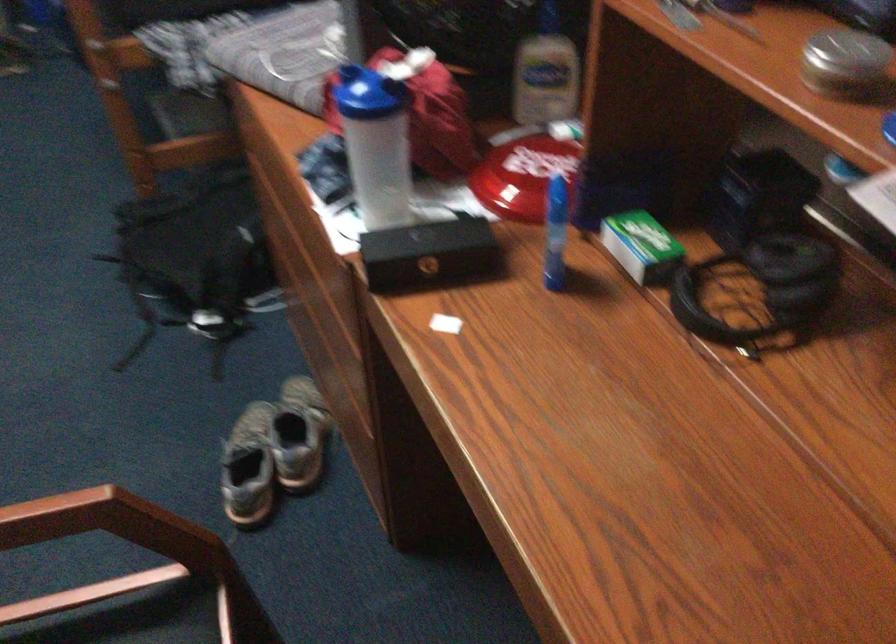
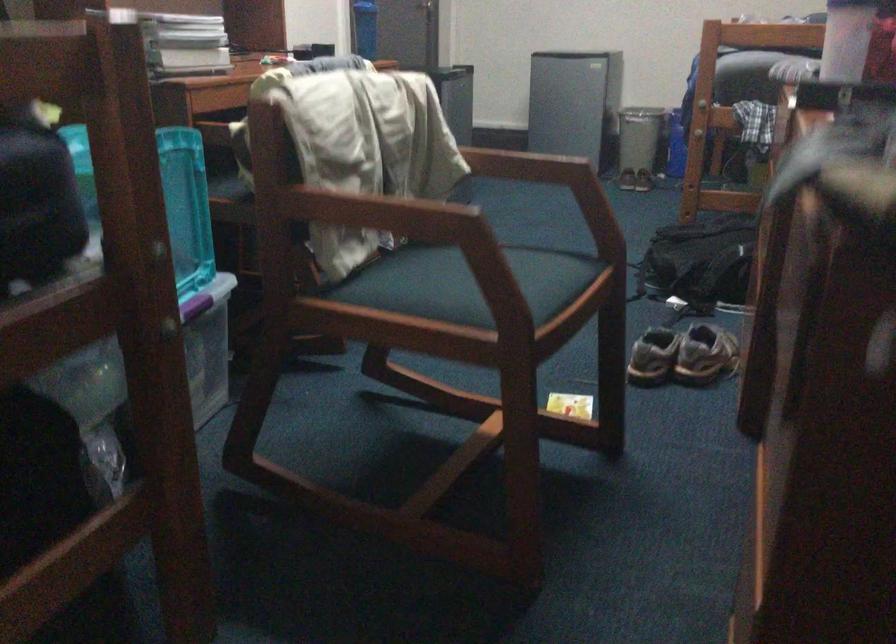
Where in the second image is the point corresponding to (x=205, y=269) from the first image?

(701, 260)